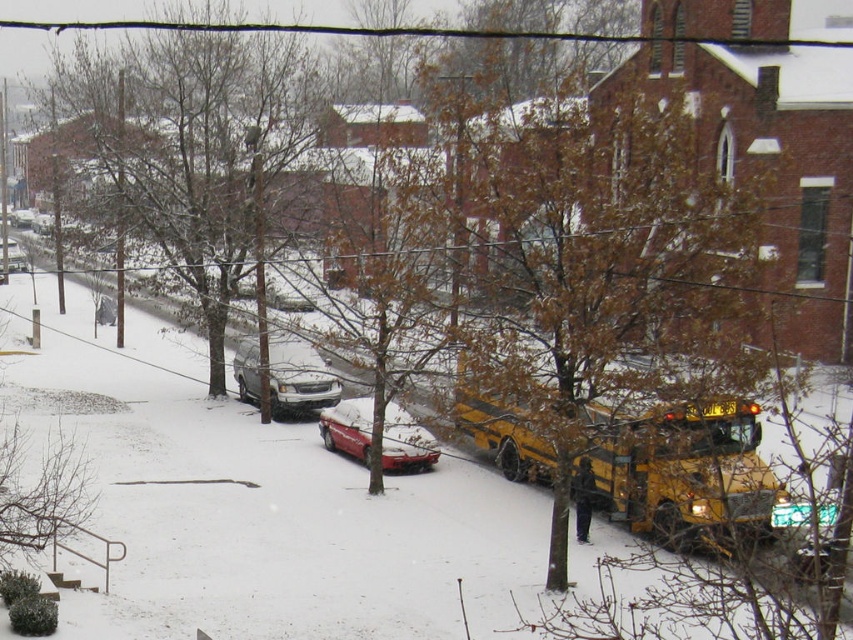
Question: Among these objects, which one is nearest to the camera?

Choices:
 (A) silver metallic suv at center
 (B) yellow matte school bus at center
 (C) shiny red car at center

Answer: (B)

Question: Is yellow matte school bus at center bigger than shiny red car at center?

Choices:
 (A) yes
 (B) no

Answer: (A)

Question: Is yellow matte school bus at center positioned before shiny red car at center?

Choices:
 (A) yes
 (B) no

Answer: (A)

Question: Among these objects, which one is nearest to the camera?

Choices:
 (A) shiny red car at center
 (B) silver metallic suv at center
 (C) yellow matte school bus at center

Answer: (C)

Question: Is yellow matte school bus at center above silver metallic suv at center?

Choices:
 (A) yes
 (B) no

Answer: (B)

Question: Which object appears farthest from the camera in this image?

Choices:
 (A) shiny red car at center
 (B) yellow matte school bus at center

Answer: (A)